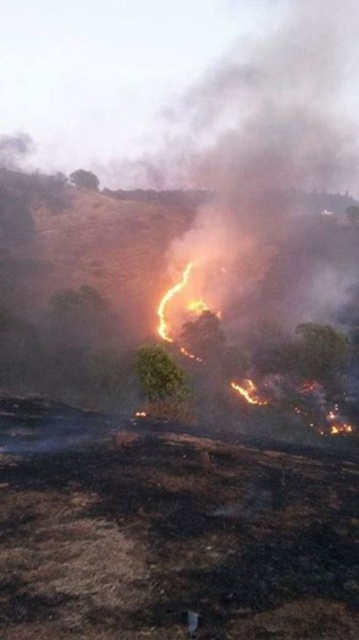
What do you see at coordinates (160, 380) in the screenshot? I see `green leafy tree at center` at bounding box center [160, 380].

Is green leafy tree at center bigger than green leafy tree at upper center?

No, green leafy tree at center is not bigger than green leafy tree at upper center.

The image size is (359, 640). I want to click on green leafy tree at center, so click(x=160, y=380).

Does charcoal ash hillside at center appear over green leafy tree at center?

Correct, charcoal ash hillside at center is located above green leafy tree at center.

Does charcoal ash hillside at center lie behind green leafy tree at center?

That is True.

Between point (277, 420) and point (165, 412), which one is positioned behind?

Point (277, 420)

Locate an element on the screen. charcoal ash hillside at center is located at coordinates (174, 301).

Does charcoal ash hillside at center appear over green leafy tree at upper center?

No.

Who is more distant from viewer, (x=357, y=355) or (x=76, y=176)?

The point (x=76, y=176) is more distant.

Who is more forward, (156, 237) or (76, 186)?

Positioned in front is point (156, 237).

This screenshot has width=359, height=640. What are the coordinates of `charcoal ash hillside at center` in the screenshot? It's located at (174, 301).